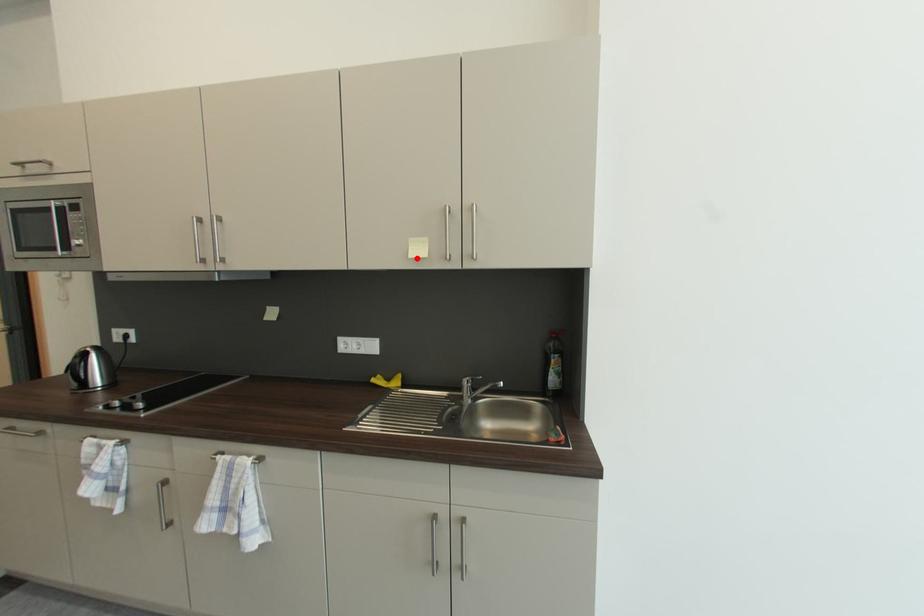
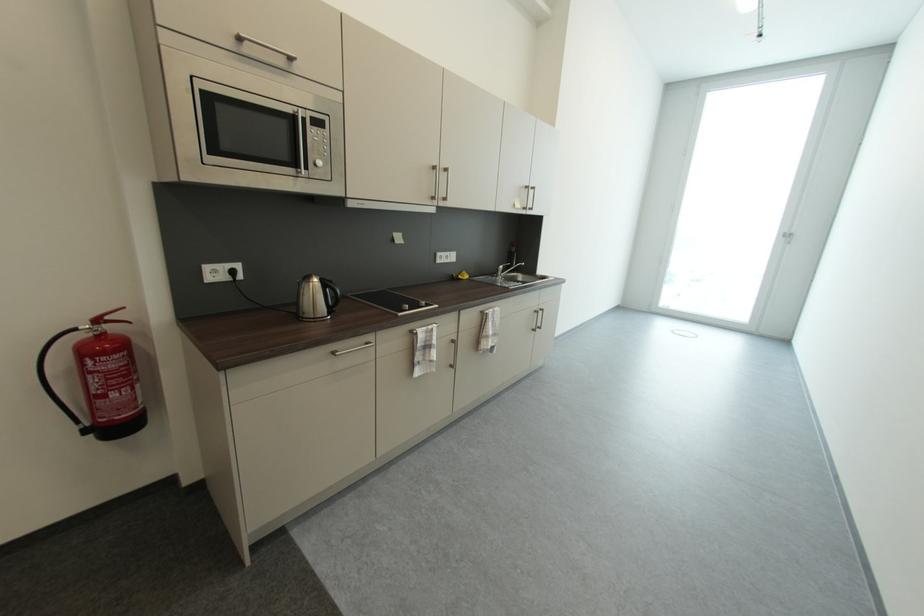
Question: I am providing you with two images of the same scene from different viewpoints. In image1, a red point is highlighted. Considering the same 3D point in image2, which of the following is correct?

Choices:
 (A) It is closer
 (B) It is farther

Answer: (A)